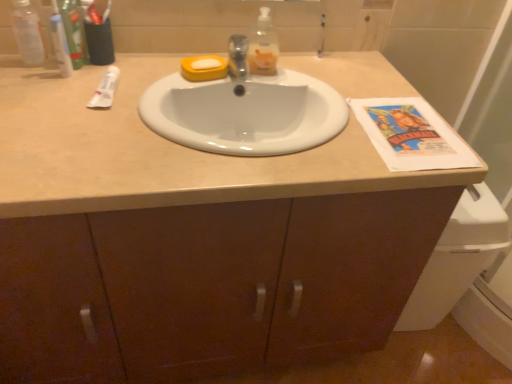
Where is `free space to the left of white matte tube at upper left`? The image size is (512, 384). free space to the left of white matte tube at upper left is located at coordinates (45, 89).